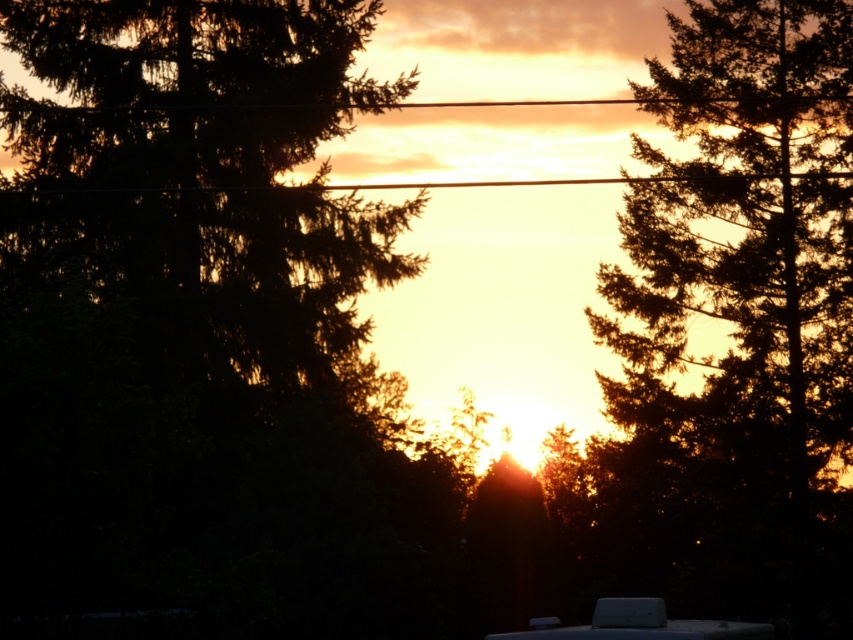
You are standing in the sunset scene and want to find the dark green textured tree at right. Where should you look relative to the point at coordinates (740, 321)?

The dark green textured tree at right is located exactly at the point with coordinates (740, 321).

You are a photographer trying to capture the sunset scene. The dark green textured tree at right is blocking part of the sunset. To avoid the tree, should you move left or right?

Since the dark green textured tree at right is positioned at point 0.503 on the x and y axis, moving left would place you further away from the tree, allowing you to capture the sunset without obstruction.

You are a photographer planning to capture a sunset shot. You have a camera with a 24mm lens that can capture a maximum width of 3 meters. You notice the dark green textured tree at right and the white matte recreational vehicle at lower center in the scene. Can both objects fit within your camera frame if you position yourself to include both?

The dark green textured tree at right has a smaller width than the white matte recreational vehicle at lower center. Since the total width of both objects combined may still be within the 3 meters limit, they can potentially fit within the camera frame. However, exact placement and distance would determine the final result.